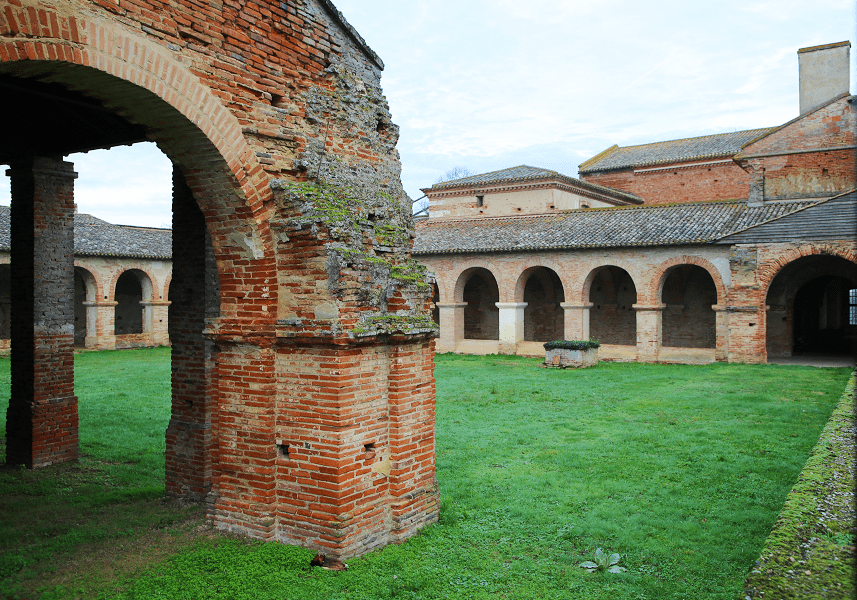
Find the location of a particular element. This screenshot has width=857, height=600. column is located at coordinates (45, 249), (189, 290), (97, 307), (157, 285), (442, 285), (508, 283), (574, 283), (638, 280).